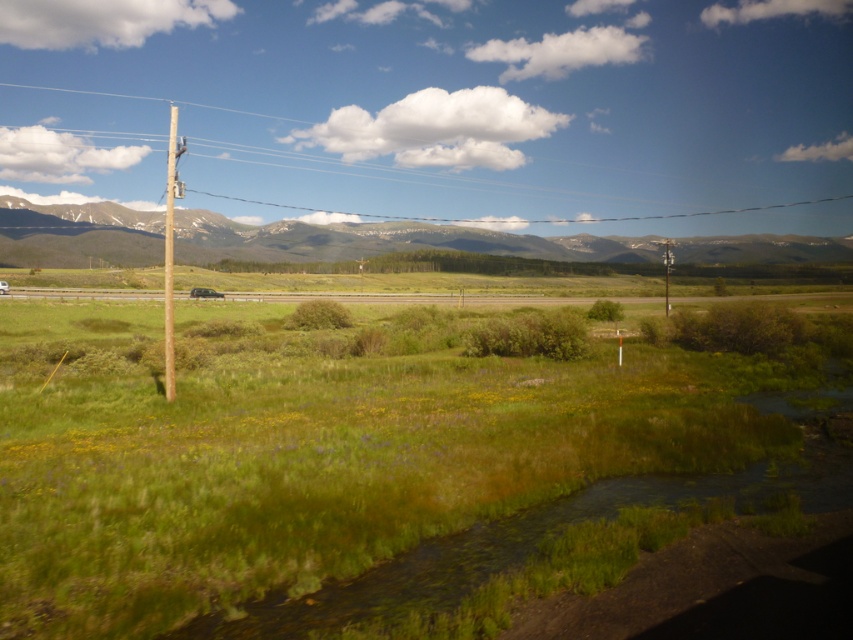
Locate an element on the screen. snowy rock mountain range at upper center is located at coordinates (383, 241).

Can you confirm if snowy rock mountain range at upper center is positioned below matte black suv at center?

No.

This screenshot has height=640, width=853. I want to click on snowy rock mountain range at upper center, so click(x=383, y=241).

Is brown wooden telegraph pole at left smaller than matte black suv at center?

Incorrect, brown wooden telegraph pole at left is not smaller in size than matte black suv at center.

Does brown wooden telegraph pole at left appear on the left side of matte black suv at center?

Yes, brown wooden telegraph pole at left is to the left of matte black suv at center.

Image resolution: width=853 pixels, height=640 pixels. Identify the location of brown wooden telegraph pole at left. (170, 250).

Does brown wooden pole at upper left lie behind brown wooden telegraph pole at left?

Yes, it is behind brown wooden telegraph pole at left.

Does point (767, 209) lie in front of point (165, 204)?

No, (767, 209) is further to viewer.

Locate an element on the screen. This screenshot has width=853, height=640. brown wooden pole at upper left is located at coordinates (524, 218).